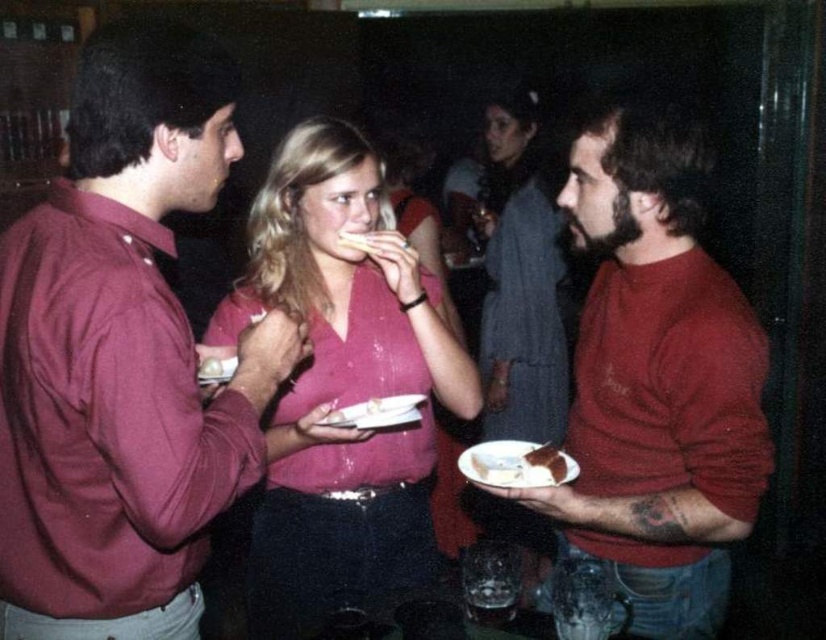
Question: Can you confirm if matte maroon shirt at left is positioned above chocolate cake at right?

Choices:
 (A) yes
 (B) no

Answer: (A)

Question: Which point is closer to the camera?

Choices:
 (A) (495, 467)
 (B) (392, 401)

Answer: (A)

Question: Which point is farther from the camera taking this photo?

Choices:
 (A) (311, 140)
 (B) (491, 452)
 (C) (368, 428)

Answer: (A)

Question: Which point is closer to the camera?

Choices:
 (A) (336, 484)
 (B) (571, 182)

Answer: (B)

Question: Can you confirm if matte maroon shirt at left is positioned above white paper plate at center?

Choices:
 (A) yes
 (B) no

Answer: (A)

Question: Is matte maroon shirt at left thinner than matte red sweater at right?

Choices:
 (A) no
 (B) yes

Answer: (B)